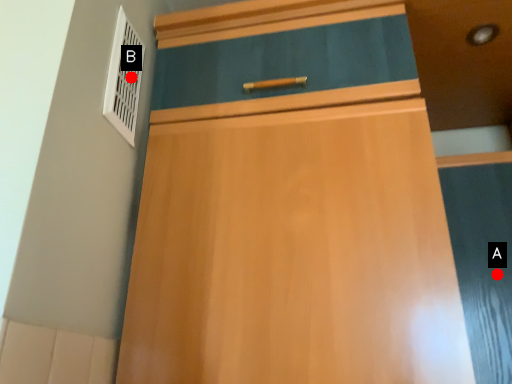
Question: Two points are circled on the image, labeled by A and B beside each circle. Among these points, which one is nearest to the camera?

Choices:
 (A) A is closer
 (B) B is closer

Answer: (B)